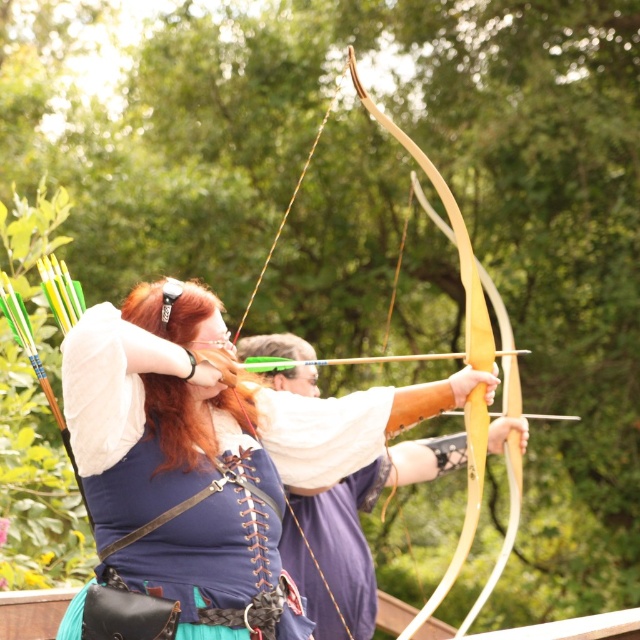
Is point (179, 320) farther from viewer compared to point (365, 362)?

No, (179, 320) is closer to viewer.

Locate an element on the screen. The height and width of the screenshot is (640, 640). matte blue shirt at center is located at coordinates (209, 410).

The height and width of the screenshot is (640, 640). I want to click on matte blue shirt at center, so click(x=209, y=410).

In order to click on matte blue shirt at center in this screenshot , I will do `click(209, 410)`.